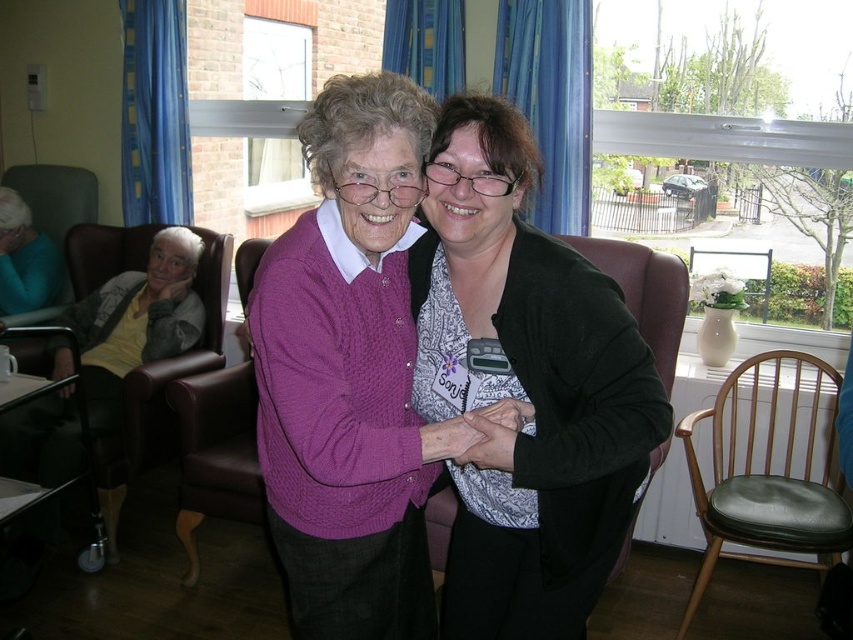
You are a photographer setting up a shoot in this room. You want to focus on the matte purple sweater at center and the matte yellow sweater at left. Which sweater should you adjust your camera focus to first if you want to capture both clearly in the same shot?

The matte purple sweater at center is closer to the viewer than the matte yellow sweater at left. To capture both clearly, focus on the matte purple sweater at center first, as it is closer, and the matte yellow sweater at left will naturally fall into focus if within the depth of field.

You are a nurse in this care facility and need to determine which object occupies more horizontal space. Based on the scene, which is wider between the green leather armchair at lower right and the matte yellow sweater at left?

The green leather armchair at lower right is wider than the matte yellow sweater at left according to the description.